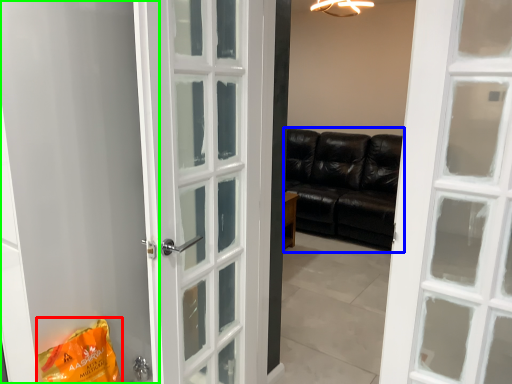
Question: Estimate the real-world distances between objects in this image. Which object is farther from shopping bag (highlighted by a red box), studio couch (highlighted by a blue box) or screen door (highlighted by a green box)?

Choices:
 (A) studio couch
 (B) screen door

Answer: (A)